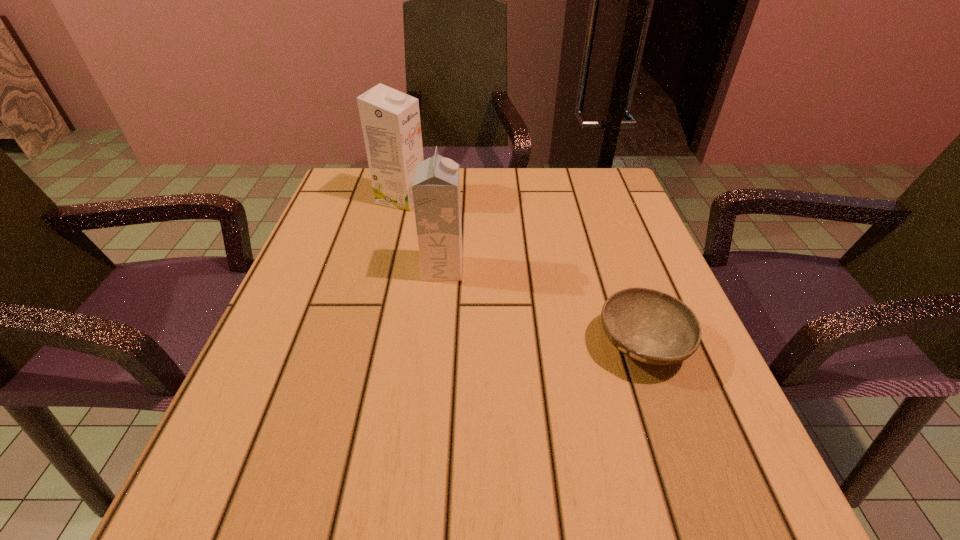
The width and height of the screenshot is (960, 540). Identify the location of object that is at the left edge. (390, 119).

The image size is (960, 540). I want to click on object that is at the right edge, so click(649, 326).

Locate an element on the screen. The width and height of the screenshot is (960, 540). object that is at the far left corner is located at coordinates (390, 119).

I want to click on vacant space at the far edge, so click(534, 169).

You are a GUI agent. You are given a task and a screenshot of the screen. Output one action in this format:
    pyautogui.click(x=<x>, y=<y>)
    Task: Click on the free point at the near edge
    The width and height of the screenshot is (960, 540).
    Given the screenshot: What is the action you would take?
    pyautogui.click(x=460, y=501)

This screenshot has width=960, height=540. I want to click on blank space at the left edge of the desktop, so click(322, 256).

Where is `free space at the right edge`? This screenshot has height=540, width=960. free space at the right edge is located at coordinates (602, 221).

Identify the location of free space at the far right corner of the desktop. The height and width of the screenshot is (540, 960). coord(614,204).

Identify the location of vacant space at the near right corner of the desktop. (721, 494).

You are a GUI agent. You are given a task and a screenshot of the screen. Output one action in this format:
    pyautogui.click(x=<x>, y=<y>)
    Task: Click on the free area in between the right carton and the nearest object
    
    Given the screenshot: What is the action you would take?
    pyautogui.click(x=543, y=306)